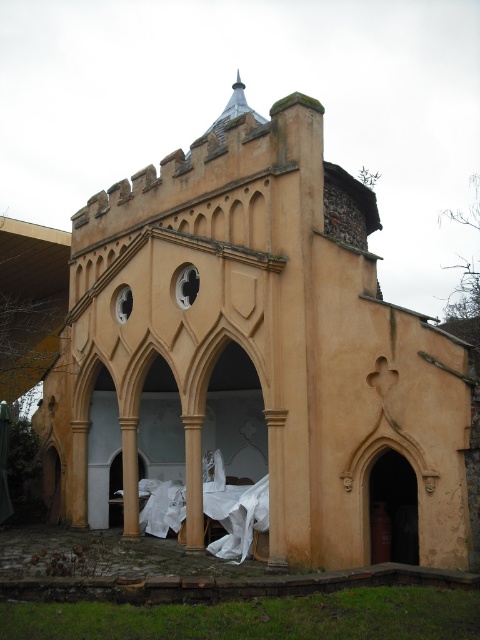
Question: Can you confirm if smooth stone column at center is thinner than beige stone column at center?

Choices:
 (A) no
 (B) yes

Answer: (B)

Question: Which of the following is the farthest from the observer?

Choices:
 (A) (282, 440)
 (B) (196, 419)

Answer: (B)

Question: Can you confirm if smooth stone column at center is positioned above beige stone column at center?

Choices:
 (A) no
 (B) yes

Answer: (B)

Question: Is smooth stone column at center wider than beige stone column at center?

Choices:
 (A) yes
 (B) no

Answer: (B)